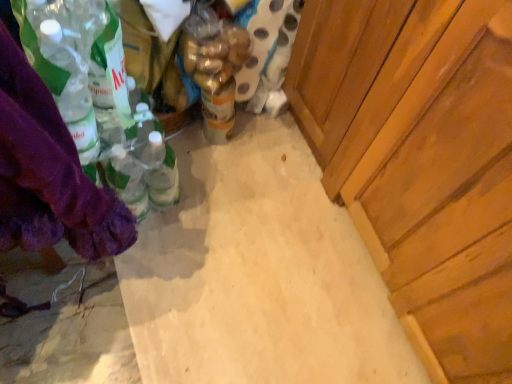
Question: Relative to purple fabric at left, is wooden cabinet at right in front or behind?

Choices:
 (A) behind
 (B) front

Answer: (A)

Question: From a real-world perspective, is wooden cabinet at right above or below purple fabric at left?

Choices:
 (A) below
 (B) above

Answer: (A)

Question: Which is farther from the yellow matte can at center?

Choices:
 (A) wooden cabinet at right
 (B) purple fabric at left
 (C) translucent plastic bottle at center

Answer: (B)

Question: Considering the real-world distances, which object is closest to the purple fabric at left?

Choices:
 (A) translucent plastic bottle at center
 (B) yellow matte can at center
 (C) wooden cabinet at right

Answer: (A)